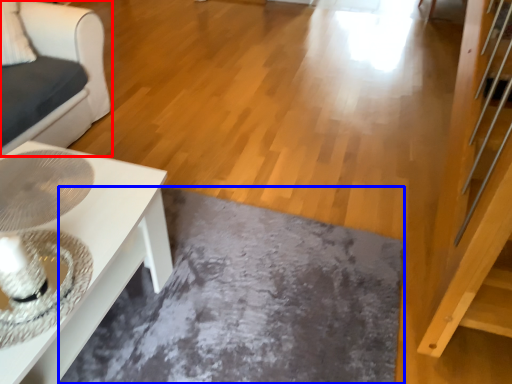
Question: Among these objects, which one is farthest to the camera, furniture (highlighted by a red box) or slate (highlighted by a blue box)?

Choices:
 (A) furniture
 (B) slate

Answer: (A)